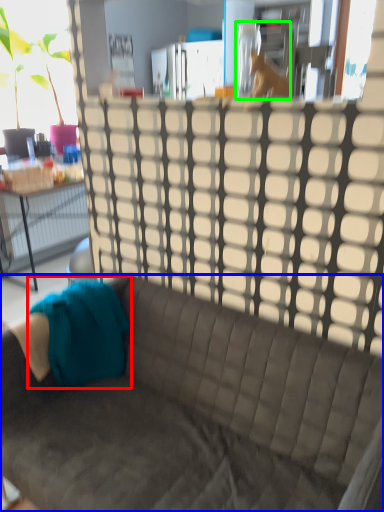
Question: Considering the real-world distances, which object is farthest from fabric (highlighted by a red box)? studio couch (highlighted by a blue box) or animal (highlighted by a green box)?

Choices:
 (A) studio couch
 (B) animal

Answer: (B)